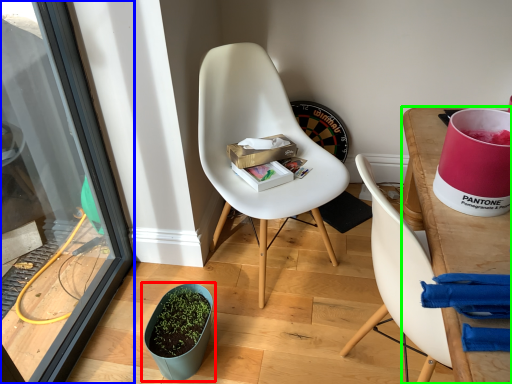
Question: Considering the real-world distances, which object is farthest from flowerpot (highlighted by a red box)? screen door (highlighted by a blue box) or desk (highlighted by a green box)?

Choices:
 (A) screen door
 (B) desk

Answer: (B)